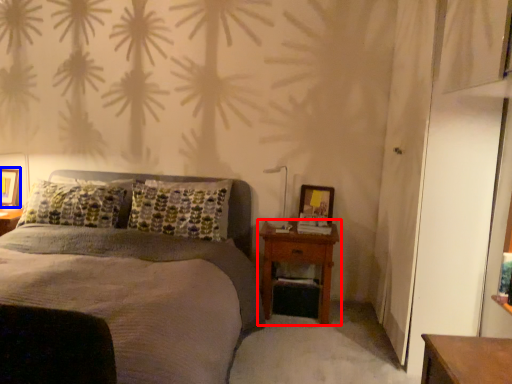
Question: Which object is further to the camera taking this photo, nightstand (highlighted by a red box) or picture frame (highlighted by a blue box)?

Choices:
 (A) nightstand
 (B) picture frame

Answer: (B)